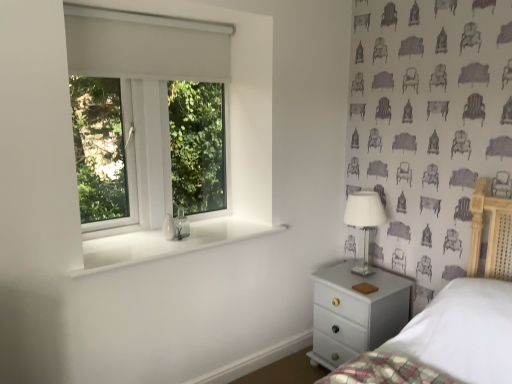
The image size is (512, 384). Describe the element at coordinates (167, 121) in the screenshot. I see `white plastic window at upper left` at that location.

Where is `white glass table lamp at right`? This screenshot has height=384, width=512. white glass table lamp at right is located at coordinates (364, 221).

From the image's perspective, is white glossy window sill at lower left above or below white glass table lamp at right?

From the image's perspective, white glossy window sill at lower left appears below white glass table lamp at right.

Based on the photo, which of these two, white glossy window sill at lower left or white glass table lamp at right, is bigger?

Bigger between the two is white glass table lamp at right.

Is point (168, 255) positioned after point (355, 224)?

No, it is not.

What's the angular difference between white glossy window sill at lower left and white glass table lamp at right's facing directions?

The angular difference between white glossy window sill at lower left and white glass table lamp at right is 91.3 degrees.

Is white glossy window sill at lower left at the back of white glossy chest of drawers at lower right?

white glossy chest of drawers at lower right does not have its back to white glossy window sill at lower left.

From a real-world perspective, who is located higher, white glossy chest of drawers at lower right or white glossy window sill at lower left?

white glossy window sill at lower left, from a real-world perspective.

Locate an element on the screen. This screenshot has height=384, width=512. the chest of drawers that appears behind the white glossy window sill at lower left is located at coordinates coord(355,313).

Is white glossy chest of drawers at lower right inside or outside of white glossy window sill at lower left?

white glossy chest of drawers at lower right is outside white glossy window sill at lower left.

Considering the sizes of objects white glossy chest of drawers at lower right and white glass table lamp at right in the image provided, who is taller, white glossy chest of drawers at lower right or white glass table lamp at right?

Standing taller between the two is white glossy chest of drawers at lower right.

Could you tell me if white glossy chest of drawers at lower right is turned towards white glass table lamp at right?

No, white glossy chest of drawers at lower right is not oriented towards white glass table lamp at right.

Image resolution: width=512 pixels, height=384 pixels. Find the location of `table lamp that is on the right side of white glossy chest of drawers at lower right`. table lamp that is on the right side of white glossy chest of drawers at lower right is located at coordinates (364, 221).

From the picture: From a real-world perspective, is white glossy window sill at lower left physically located above or below white plastic window at upper left?

Clearly, from a real-world perspective, white glossy window sill at lower left is below white plastic window at upper left.

Based on the photo, considering the relative sizes of white glossy window sill at lower left and white plastic window at upper left in the image provided, is white glossy window sill at lower left taller than white plastic window at upper left?

In fact, white glossy window sill at lower left may be shorter than white plastic window at upper left.

Looking at this image, would you consider white glossy window sill at lower left to be distant from white plastic window at upper left?

No, white glossy window sill at lower left is not far away from white plastic window at upper left.

In order to click on window behind the white glossy window sill at lower left in this screenshot , I will do `click(167, 121)`.

Identify the location of window sill on the left of white glossy chest of drawers at lower right. (165, 243).

Is the depth of white glossy window sill at lower left greater than that of white glossy chest of drawers at lower right?

No.

From the image's perspective, which is above, white glossy window sill at lower left or white glossy chest of drawers at lower right?

white glossy window sill at lower left.

Can you confirm if white glossy window sill at lower left is shorter than white glossy chest of drawers at lower right?

Indeed, white glossy window sill at lower left has a lesser height compared to white glossy chest of drawers at lower right.

Which is less distant, (344,216) or (330,305)?

The point (330,305) is in front.

Which object is positioned more to the right, white glass table lamp at right or white glossy chest of drawers at lower right?

Positioned to the right is white glass table lamp at right.

Considering the sizes of white glass table lamp at right and white glossy chest of drawers at lower right in the image, is white glass table lamp at right taller or shorter than white glossy chest of drawers at lower right?

In the image, white glass table lamp at right appears to be shorter than white glossy chest of drawers at lower right.

Is white glass table lamp at right touching white glossy chest of drawers at lower right?

No, white glass table lamp at right is not next to white glossy chest of drawers at lower right.

Does white glossy chest of drawers at lower right appear on the left side of white plastic window at upper left?

No, white glossy chest of drawers at lower right is not to the left of white plastic window at upper left.

Which object is closer to the camera, white glossy chest of drawers at lower right or white plastic window at upper left?

white plastic window at upper left is in front.

Is white glossy chest of drawers at lower right taller than white plastic window at upper left?

No, white glossy chest of drawers at lower right is not taller than white plastic window at upper left.

Based on the photo, from the image's perspective, is white glossy chest of drawers at lower right over white plastic window at upper left?

No, from the image's perspective, white glossy chest of drawers at lower right is not over white plastic window at upper left.

At what (x,y) coordinates should I click in order to perform the action: click on table lamp lying behind the white glossy window sill at lower left. Please return your answer as a coordinate pair (x, y). This screenshot has width=512, height=384. Looking at the image, I should click on (364, 221).

Identify the location of window sill on the left of white glossy chest of drawers at lower right. (165, 243).

Looking at the image, which one is located closer to white glossy window sill at lower left, white glossy chest of drawers at lower right or white glass table lamp at right?

white glossy chest of drawers at lower right is closer to white glossy window sill at lower left.

Looking at the image, which one is located further to white glossy window sill at lower left, white glossy chest of drawers at lower right or white plastic window at upper left?

Based on the image, white glossy chest of drawers at lower right appears to be further to white glossy window sill at lower left.

Based on their spatial positions, is white glossy window sill at lower left or white plastic window at upper left further from white glass table lamp at right?

white plastic window at upper left is positioned further to the anchor white glass table lamp at right.

From the picture: When comparing their distances from white glossy window sill at lower left, does white plastic window at upper left or white glossy chest of drawers at lower right seem closer?

white plastic window at upper left.

From the image, which object appears to be farther from white glass table lamp at right, white glossy window sill at lower left or white glossy chest of drawers at lower right?

Based on the image, white glossy window sill at lower left appears to be further to white glass table lamp at right.

Looking at the image, which one is located closer to white plastic window at upper left, white glossy window sill at lower left or white glossy chest of drawers at lower right?

white glossy window sill at lower left is closer to white plastic window at upper left.

Looking at the image, which one is located closer to white plastic window at upper left, white glossy chest of drawers at lower right or white glass table lamp at right?

The object closer to white plastic window at upper left is white glossy chest of drawers at lower right.

Based on their spatial positions, is white glossy window sill at lower left or white plastic window at upper left further from white glossy chest of drawers at lower right?

white plastic window at upper left lies further to white glossy chest of drawers at lower right than the other object.

I want to click on window sill between white plastic window at upper left and white glossy chest of drawers at lower right, so click(x=165, y=243).

Find the location of a particular element. chest of drawers between white glossy window sill at lower left and white glass table lamp at right from left to right is located at coordinates (355, 313).

Where is `window sill situated between white plastic window at upper left and white glass table lamp at right from left to right`? The height and width of the screenshot is (384, 512). window sill situated between white plastic window at upper left and white glass table lamp at right from left to right is located at coordinates (165, 243).

At what (x,y) coordinates should I click in order to perform the action: click on chest of drawers between white plastic window at upper left and white glass table lamp at right from left to right. Please return your answer as a coordinate pair (x, y). This screenshot has width=512, height=384. Looking at the image, I should click on (355, 313).